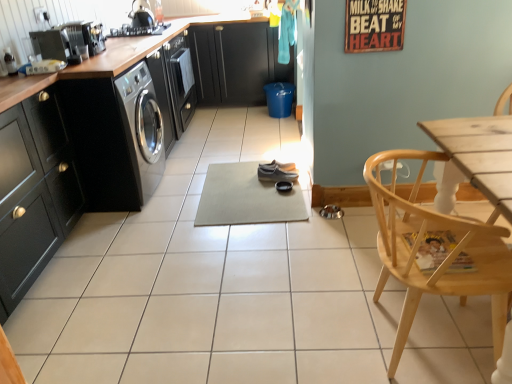
This screenshot has height=384, width=512. Find the location of `vacant space behind light wood chair at lower right`. vacant space behind light wood chair at lower right is located at coordinates (337, 262).